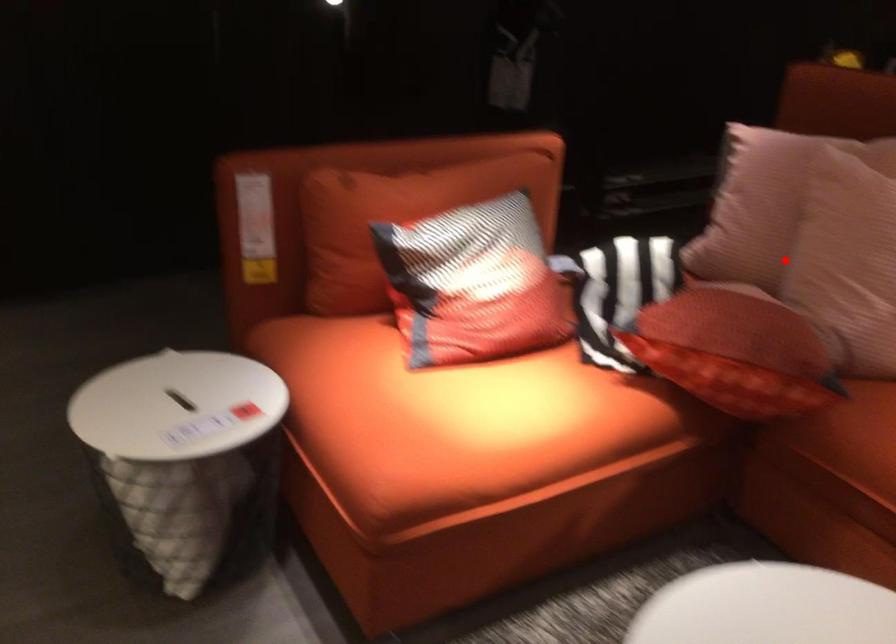
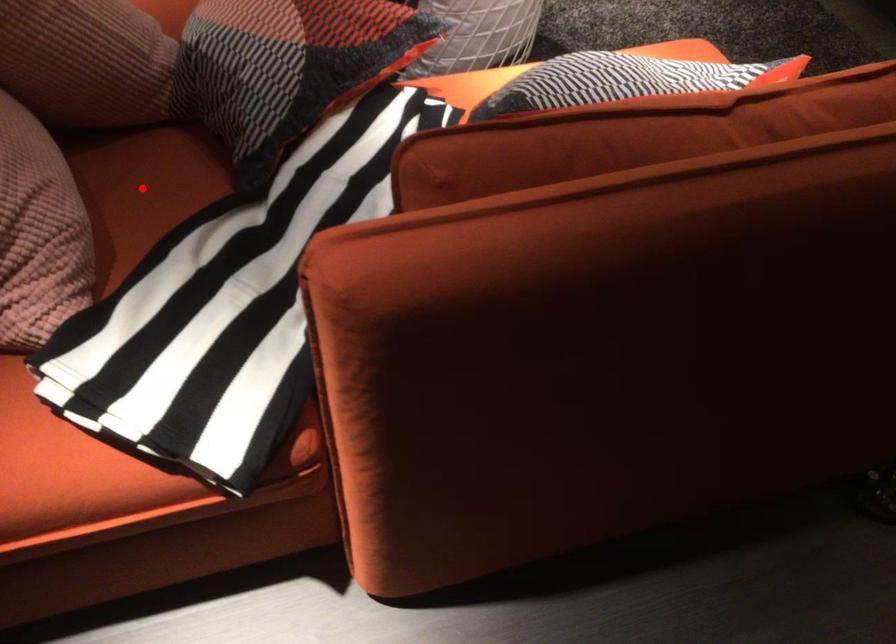
I am providing you with two images of the same scene from different viewpoints. A red point is marked on the first image and another point is marked on the second image. Is the red point in image1 aligned with the point shown in image2?

No